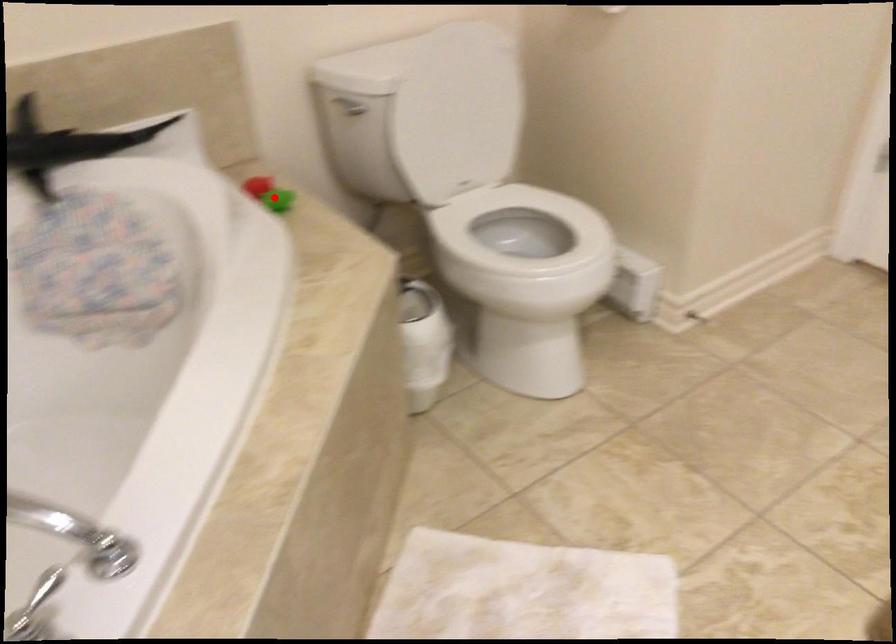
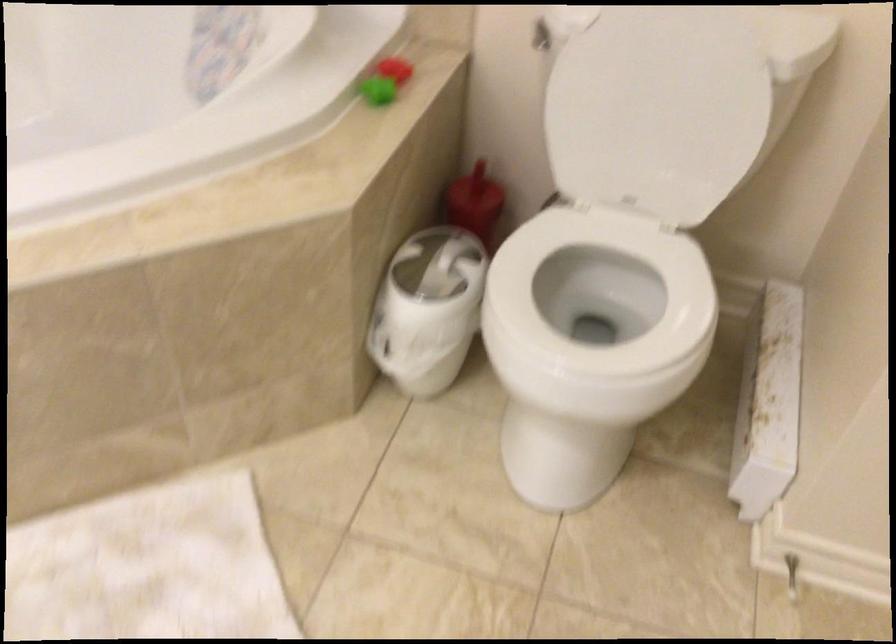
Find the pixel in the second image that matches the highlighted location in the first image.

(377, 90)